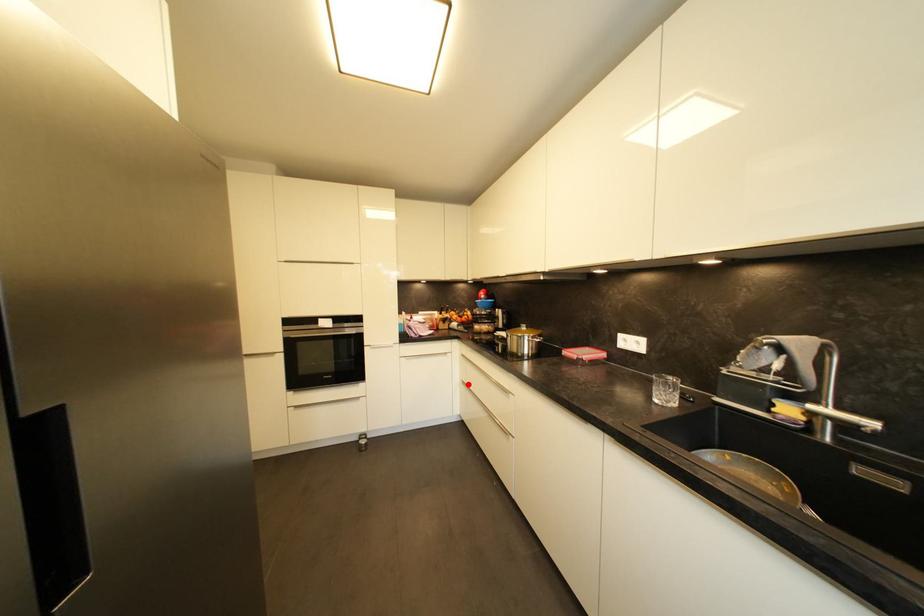
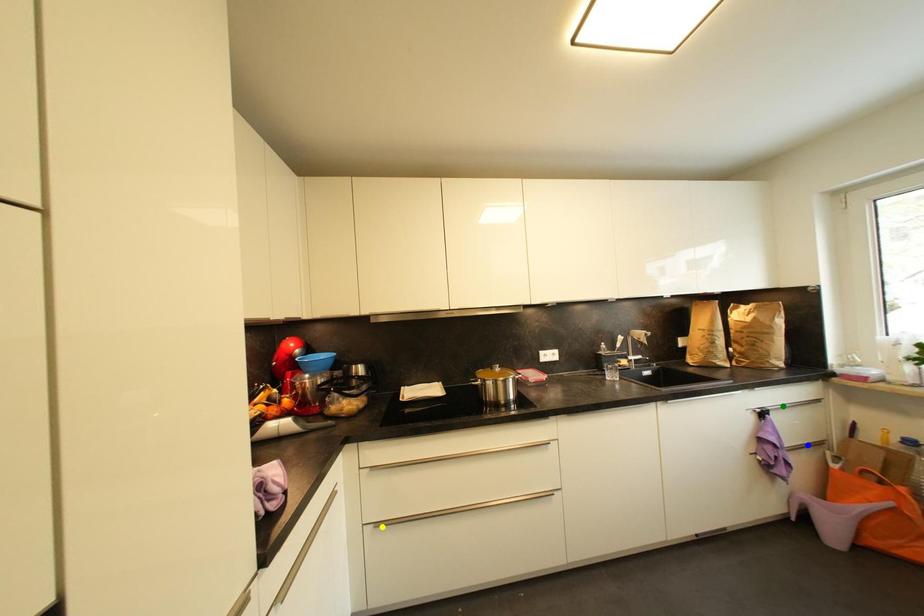
Question: I am providing you with two images of the same scene from different viewpoints. A red point is marked on the first image. You are given multiple points on the second image. Which point in image 2 is actually the same real-world point as the red point in image 1?

Choices:
 (A) yellow point
 (B) blue point
 (C) green point

Answer: (A)